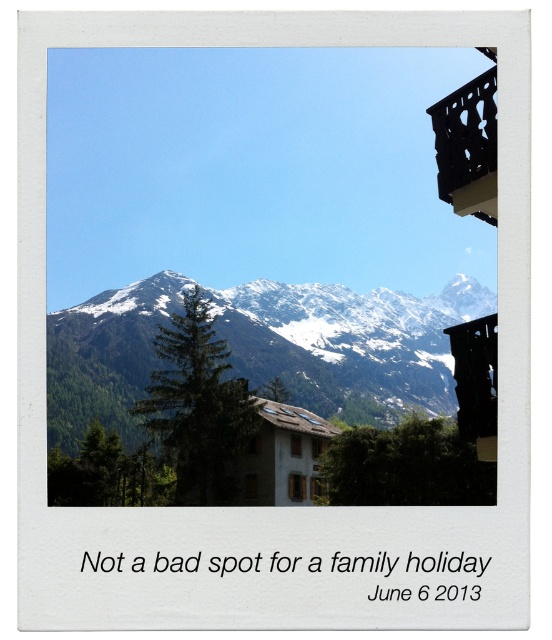
You are a painter planning to capture the snowy rock mountain range at center and the black wrought iron balcony at upper right in your painting. Which object should you focus on enlarging to emphasize its prominence in the landscape?

The snowy rock mountain range at center should be enlarged since it has a larger size compared to the black wrought iron balcony at upper right, making it the more prominent feature in the landscape.

Based on the scene description, where is the point at coordinates (348, 342) located?

The point at coordinates (348, 342) is located on the snowy rock mountain range at center.

You are standing at the base of the mountain looking at the black wrought iron balcony at upper right and the black wood balcony at upper right. Which balcony is closer to you?

The black wood balcony at upper right is closer to you since the black wrought iron balcony at upper right is 22.66 meters away from it, meaning the wrought iron one is farther away.